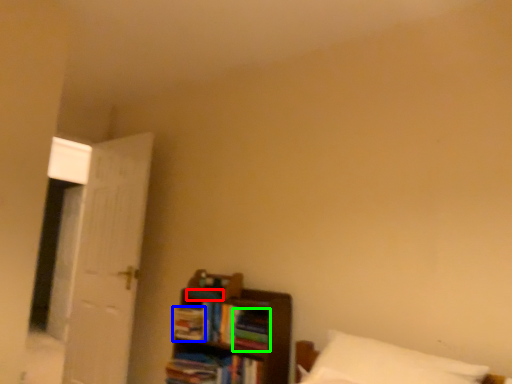
Question: Which is nearer to the book (highlighted by a red box)? book (highlighted by a blue box) or book (highlighted by a green box).

Choices:
 (A) book
 (B) book

Answer: (A)